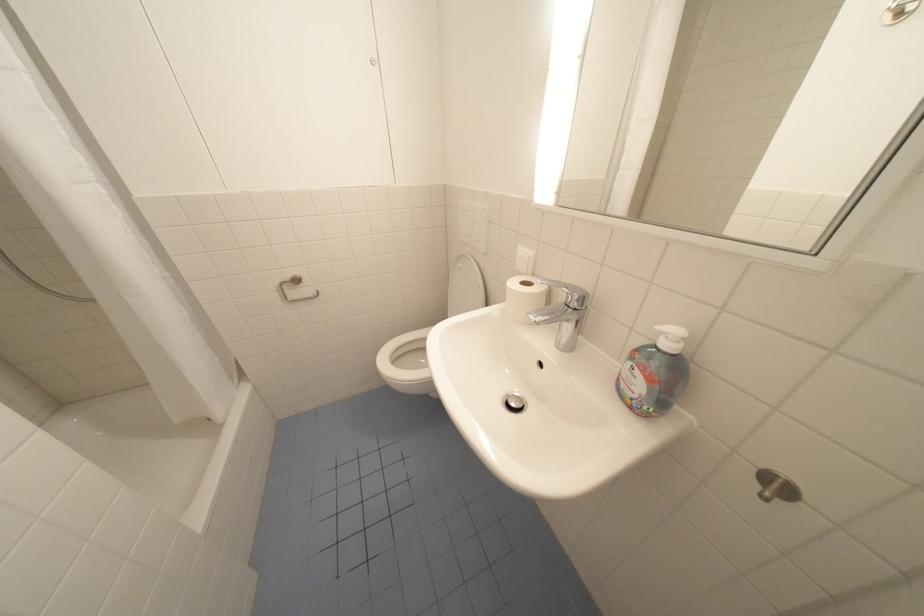
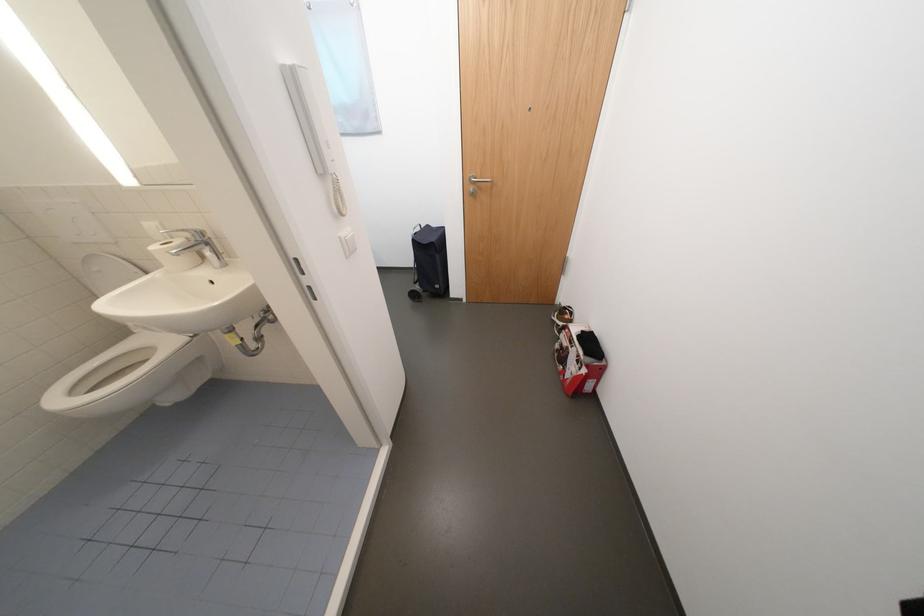
The images are taken continuously from a first-person perspective. In which direction is your viewpoint rotating?

The camera's rotation is toward right-down.